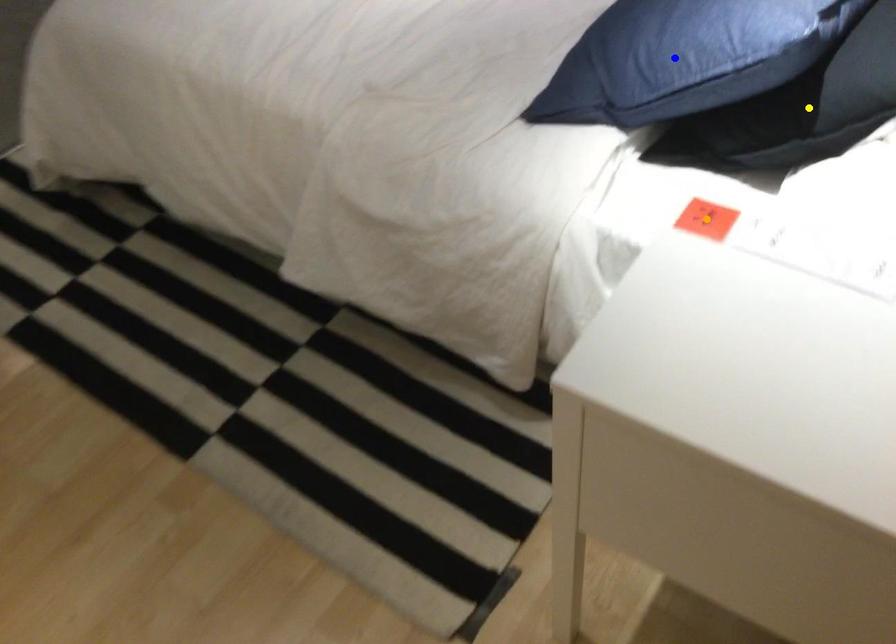
Order these from nearest to farthest:
orange point, yellow point, blue point

orange point, blue point, yellow point